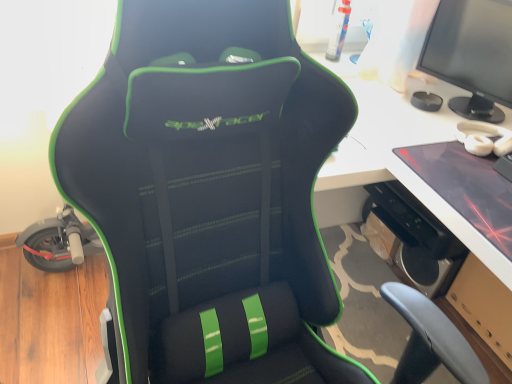
Identify the location of free space above matte black laptop at right (from a real-world perspective). The height and width of the screenshot is (384, 512). (477, 172).